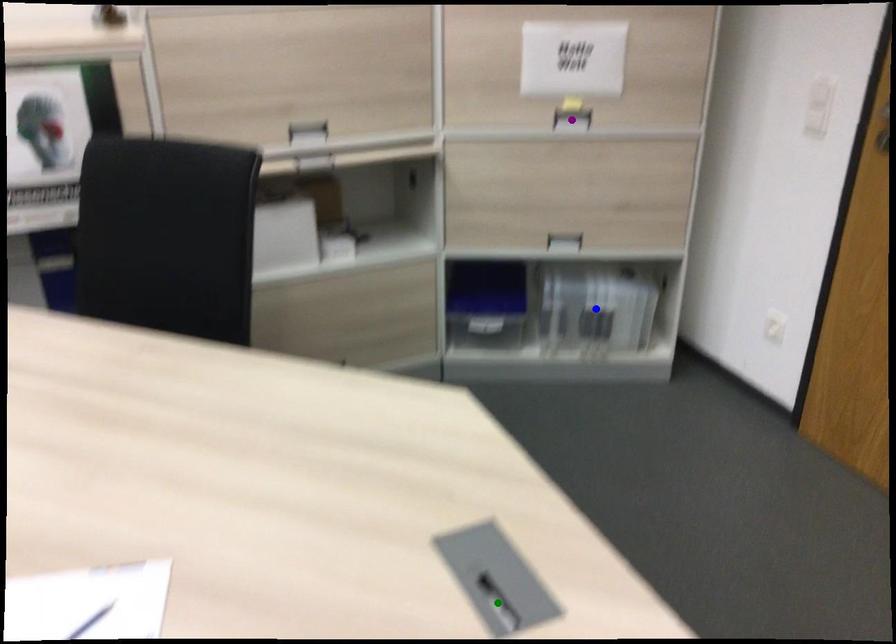
Order these from nearest to farthest:
green point
purple point
blue point

blue point → purple point → green point